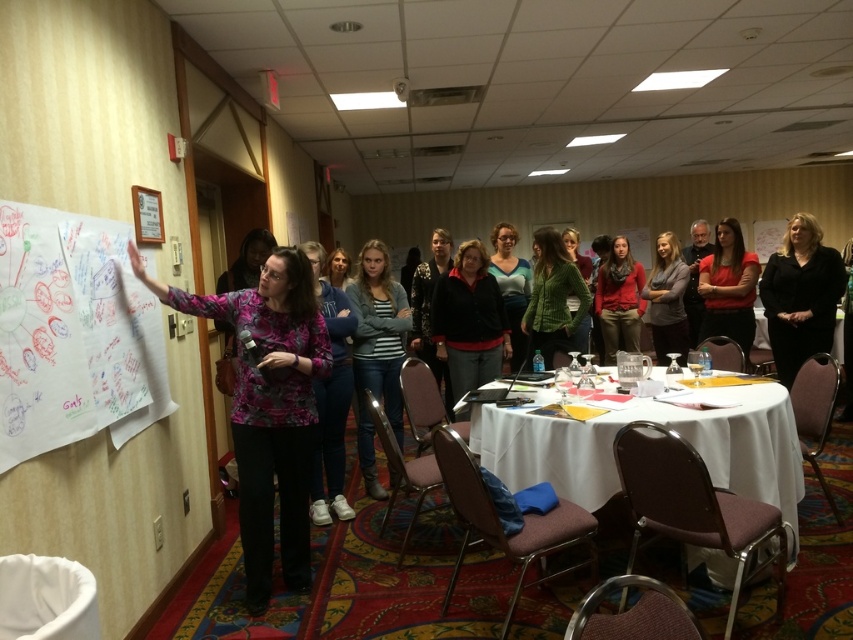
You are organizing a fashion show and need to decide which garment to display first. Both the matte red blouse at center and the matte red sweater at center are available. Based on their descriptions, which one is more suitable for a slim fit model?

The matte red blouse at center is thinner than the matte red sweater at center, so it is more suitable for a slim fit model.

You are sitting at the back of the room and want to ask a question to the person in the floral shirt at left and the matte blue shirt at center. Which person will you need to look up at more to address?

The floral shirt at left is closer to the viewer than the matte blue shirt at center, so you will need to look up less at the floral shirt at left and more at the matte blue shirt at center to address them.

You are standing in the room and want to locate the matte red blouse at center. According to the coordinates provided, where would you look relative to the whiteboard on the left?

The matte red blouse at center is located at coordinates point 0.450 on the x axis and 0.855 on the y axis, so you should look towards the center area of the image, slightly to the right of the whiteboard on the left and closer to the bottom of the image.